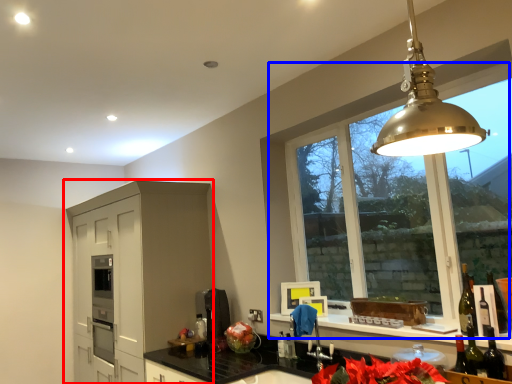
Question: Among these objects, which one is nearest to the camera, cabinetry (highlighted by a red box) or window (highlighted by a blue box)?

Choices:
 (A) cabinetry
 (B) window

Answer: (B)